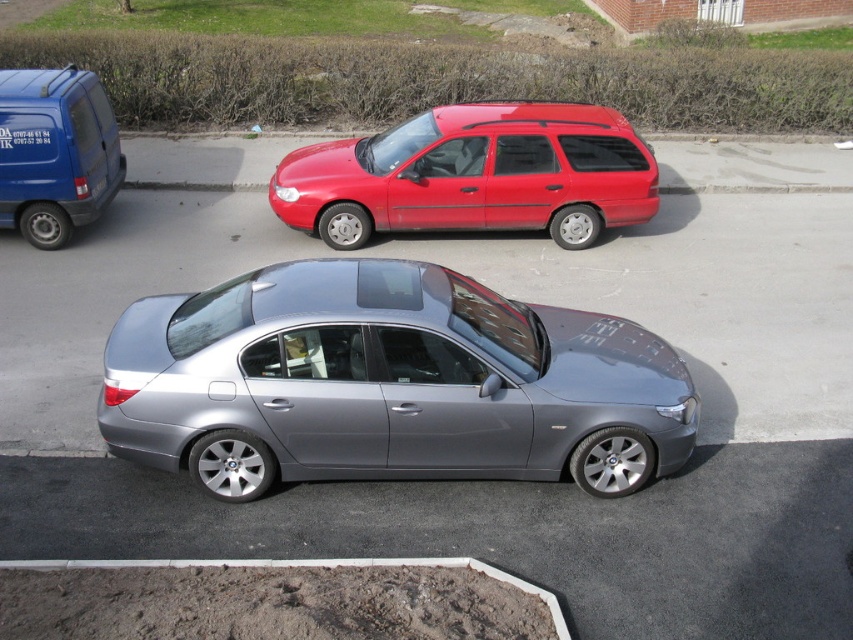
Is shiny red station wagon at center positioned in front of black plastic license plate at center?

No, it is behind black plastic license plate at center.

Is shiny red station wagon at center above black plastic license plate at center?

Yes, shiny red station wagon at center is above black plastic license plate at center.

In order to click on shiny red station wagon at center in this screenshot , I will do `click(474, 173)`.

The image size is (853, 640). Identify the location of shiny red station wagon at center. (474, 173).

Who is positioned more to the right, matte blue van at left or black plastic license plate at center?

Positioned to the right is black plastic license plate at center.

Does matte blue van at left appear on the left side of black plastic license plate at center?

Yes, matte blue van at left is to the left of black plastic license plate at center.

Is point (76, 109) positioned behind point (106, 180)?

No, it is not.

Find the location of a particular element. This screenshot has height=640, width=853. matte blue van at left is located at coordinates (54, 152).

Does satin metallic sedan at center have a lesser height compared to matte blue van at left?

Correct, satin metallic sedan at center is not as tall as matte blue van at left.

Does satin metallic sedan at center appear on the left side of matte blue van at left?

Incorrect, satin metallic sedan at center is not on the left side of matte blue van at left.

Who is more forward, (x=413, y=472) or (x=55, y=202)?

Point (x=413, y=472)

You are a GUI agent. You are given a task and a screenshot of the screen. Output one action in this format:
    pyautogui.click(x=<x>, y=<y>)
    Task: Click on the satin metallic sedan at center
    The image size is (853, 640).
    Given the screenshot: What is the action you would take?
    pyautogui.click(x=387, y=384)